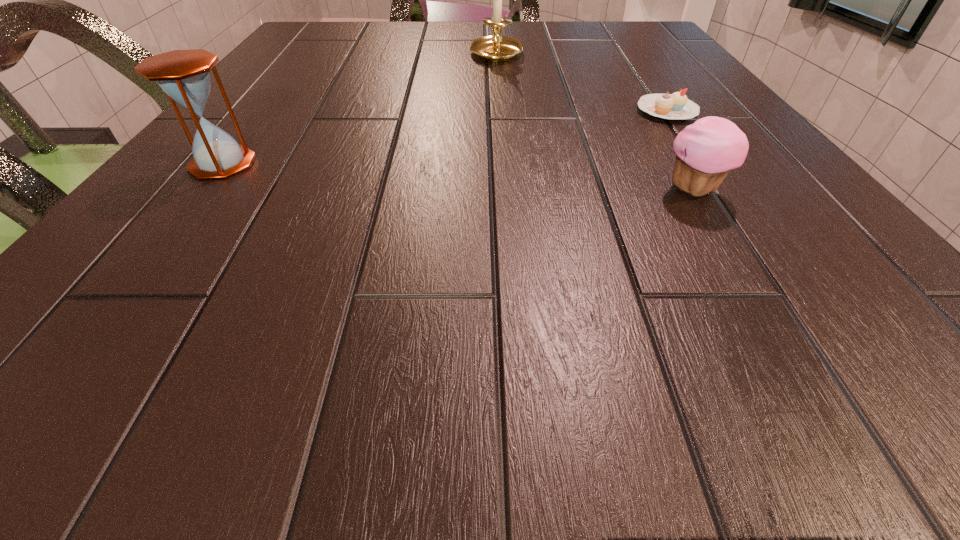
Find the location of a particular element. free spot that satisfies the following two spatial constraints: 1. on the back side of the third nearest object; 2. on the left side of the nearer cupcake is located at coordinates (646, 111).

The width and height of the screenshot is (960, 540). I want to click on free location that satisfies the following two spatial constraints: 1. on the front side of the hourglass; 2. on the right side of the taller cupcake, so click(x=203, y=190).

This screenshot has width=960, height=540. What are the coordinates of `free point that satisfies the following two spatial constraints: 1. on the front side of the leftmost object; 2. on the left side of the third tallest object` in the screenshot? It's located at (203, 190).

Where is `free space that satisfies the following two spatial constraints: 1. on the back side of the taller cupcake; 2. on the left side of the shortest object`? free space that satisfies the following two spatial constraints: 1. on the back side of the taller cupcake; 2. on the left side of the shortest object is located at coordinates (646, 111).

Image resolution: width=960 pixels, height=540 pixels. I want to click on blank space that satisfies the following two spatial constraints: 1. on the handle side of the second object from left to right; 2. on the right side of the second shortest object, so click(507, 190).